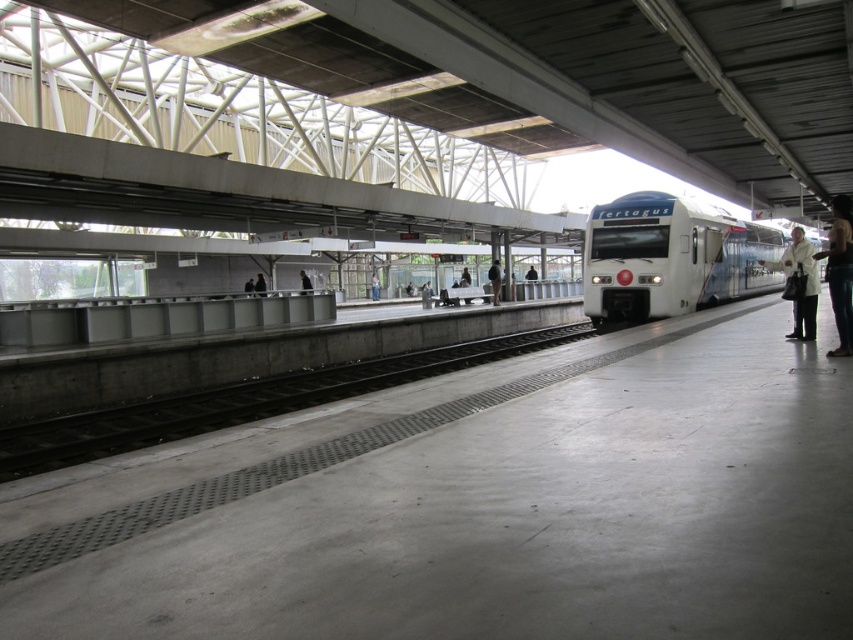
Which is in front, point (838, 244) or point (370, 291)?

Point (838, 244) is in front.

Does black leather pants at right appear over light blue jeans at center?

Incorrect, black leather pants at right is not positioned above light blue jeans at center.

Locate an element on the screen. This screenshot has height=640, width=853. black leather pants at right is located at coordinates [x=840, y=272].

Who is positioned more to the right, concrete at center or white glossy train at center?

white glossy train at center

Which is below, concrete at center or white glossy train at center?

Positioned lower is concrete at center.

You are a GUI agent. You are given a task and a screenshot of the screen. Output one action in this format:
    pyautogui.click(x=<x>, y=<y>)
    Task: Click on the concrete at center
    This screenshot has height=640, width=853.
    Given the screenshot: What is the action you would take?
    pyautogui.click(x=244, y=403)

Where is `concrete at center`? The width and height of the screenshot is (853, 640). concrete at center is located at coordinates tap(244, 403).

Can you confirm if white glossy train at center is wider than white coat at right?

Indeed, white glossy train at center has a greater width compared to white coat at right.

Based on the photo, how much distance is there between white glossy train at center and white coat at right?

white glossy train at center and white coat at right are 12.09 meters apart.

Does point (583, 298) lie in front of point (791, 256)?

No.

The width and height of the screenshot is (853, 640). In order to click on white glossy train at center in this screenshot , I will do `click(671, 257)`.